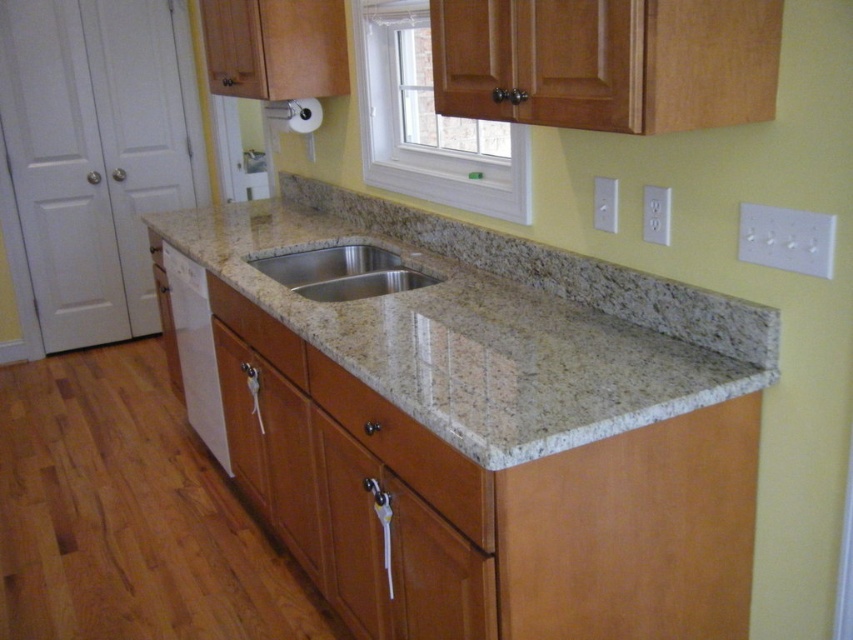
Between white glossy dishwasher at lower left and stainless steel sink at center, which one appears on the left side from the viewer's perspective?

white glossy dishwasher at lower left

Where is `white glossy dishwasher at lower left`? This screenshot has height=640, width=853. white glossy dishwasher at lower left is located at coordinates point(195,349).

This screenshot has height=640, width=853. I want to click on white glossy dishwasher at lower left, so click(x=195, y=349).

Is granite countertop at center further to the viewer compared to wooden drawer at center?

No, it is in front of wooden drawer at center.

Describe the element at coordinates (492, 323) in the screenshot. I see `granite countertop at center` at that location.

The width and height of the screenshot is (853, 640). Find the location of `granite countertop at center`. granite countertop at center is located at coordinates (492, 323).

Between wooden drawer at center and white glossy dishwasher at lower left, which one is positioned lower?

wooden drawer at center is lower down.

Is wooden drawer at center taller than white glossy dishwasher at lower left?

No.

Is point (399, 460) in front of point (206, 326)?

Yes.

Identify the location of wooden drawer at center. Image resolution: width=853 pixels, height=640 pixels. (407, 449).